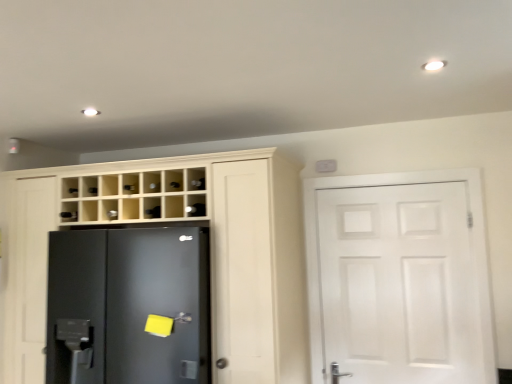
Question: Does satin nickel door handle at lower center have a lesser height compared to black glass shelf at upper center?

Choices:
 (A) yes
 (B) no

Answer: (A)

Question: Does satin nickel door handle at lower center have a lesser width compared to black glass shelf at upper center?

Choices:
 (A) yes
 (B) no

Answer: (A)

Question: From a real-world perspective, is satin nickel door handle at lower center positioned under black glass shelf at upper center based on gravity?

Choices:
 (A) no
 (B) yes

Answer: (B)

Question: Is satin nickel door handle at lower center taller than black glass shelf at upper center?

Choices:
 (A) no
 (B) yes

Answer: (A)

Question: From the image's perspective, would you say satin nickel door handle at lower center is positioned over black glass shelf at upper center?

Choices:
 (A) no
 (B) yes

Answer: (A)

Question: Is satin nickel door handle at lower center completely or partially outside of black glass shelf at upper center?

Choices:
 (A) no
 (B) yes

Answer: (B)

Question: From the image's perspective, is white matte door at right below black glass shelf at upper center?

Choices:
 (A) yes
 (B) no

Answer: (A)

Question: Is white matte door at right positioned beyond the bounds of black glass shelf at upper center?

Choices:
 (A) no
 (B) yes

Answer: (B)

Question: From a real-world perspective, is white matte door at right under black glass shelf at upper center?

Choices:
 (A) no
 (B) yes

Answer: (B)

Question: From a real-world perspective, is white matte door at right over black glass shelf at upper center?

Choices:
 (A) no
 (B) yes

Answer: (A)

Question: Considering the relative positions of white matte door at right and black glass shelf at upper center in the image provided, is white matte door at right to the right of black glass shelf at upper center from the viewer's perspective?

Choices:
 (A) no
 (B) yes

Answer: (B)

Question: Is white matte door at right wider than black glass shelf at upper center?

Choices:
 (A) no
 (B) yes

Answer: (A)

Question: Is satin nickel door handle at lower center smaller than white matte door at right?

Choices:
 (A) yes
 (B) no

Answer: (A)